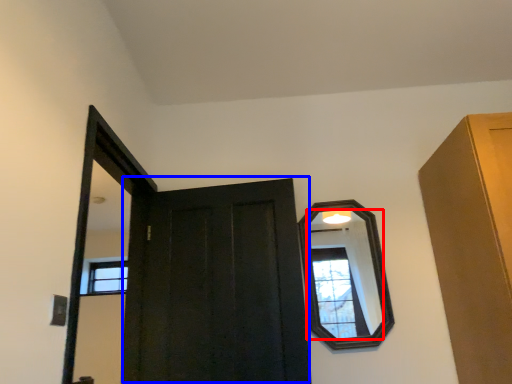
Question: Which object is closer to the camera taking this photo, mirror (highlighted by a red box) or door (highlighted by a blue box)?

Choices:
 (A) mirror
 (B) door

Answer: (B)